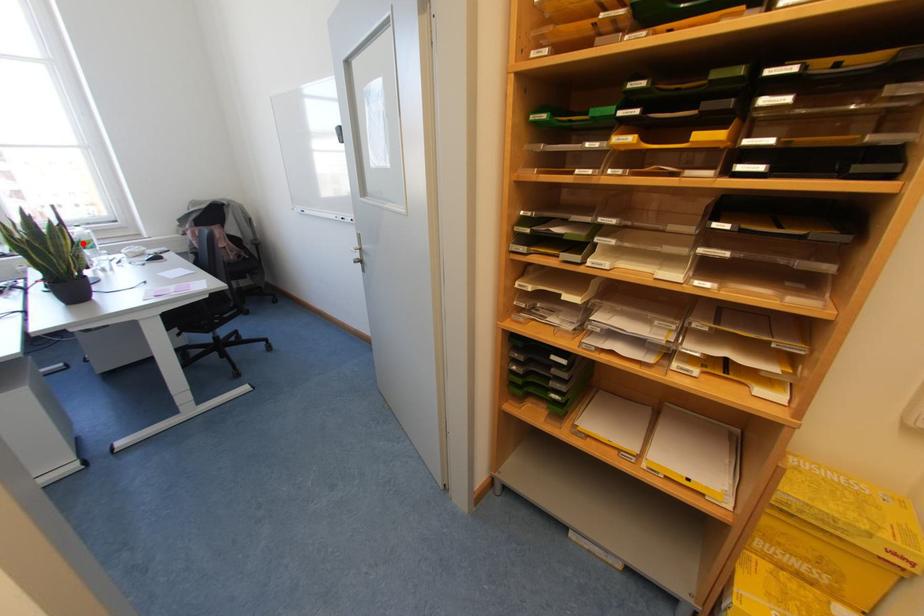
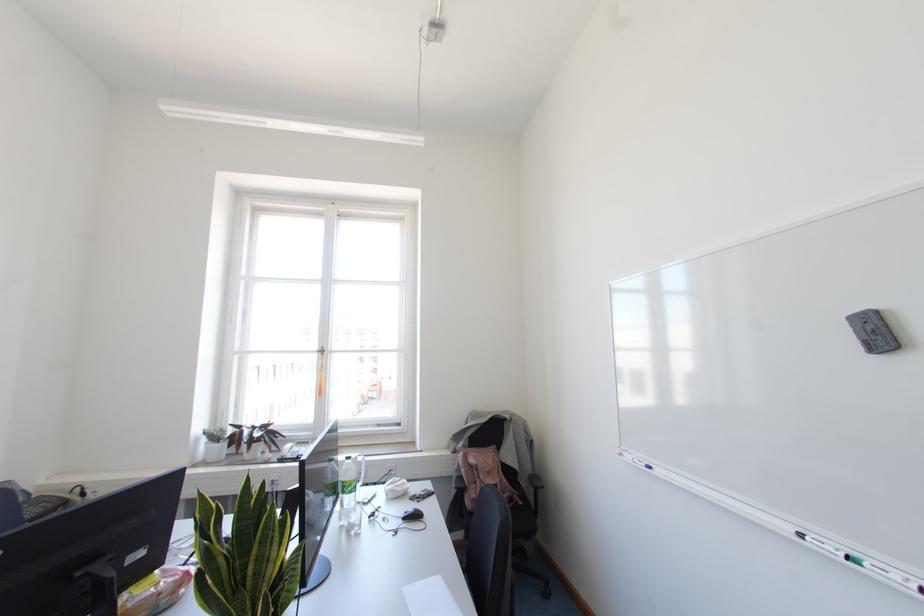
Question: I am providing you with two images of the same scene from different viewpoints. Given a red point in image1, look at the same physical point in image2. Is it:

Choices:
 (A) Closer to the viewpoint
 (B) Farther from the viewpoint

Answer: (A)